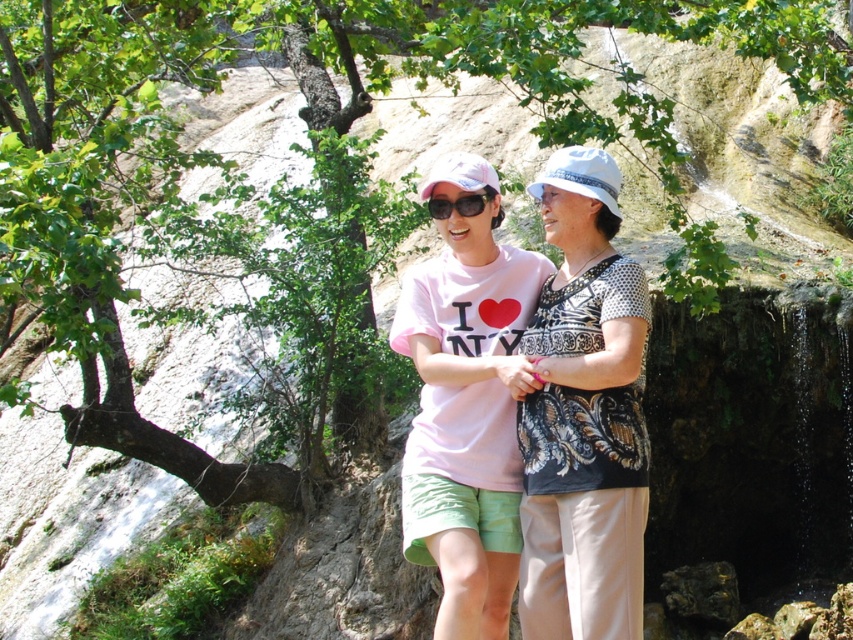
Does pink cotton t-shirt at center appear on the left side of black plastic sunglasses at center?

Incorrect, pink cotton t-shirt at center is not on the left side of black plastic sunglasses at center.

Between pink cotton t-shirt at center and black plastic sunglasses at center, which one has more height?

pink cotton t-shirt at center

In order to click on pink cotton t-shirt at center in this screenshot , I will do click(x=485, y=397).

This screenshot has width=853, height=640. What are the coordinates of `pink cotton t-shirt at center` in the screenshot? It's located at (485, 397).